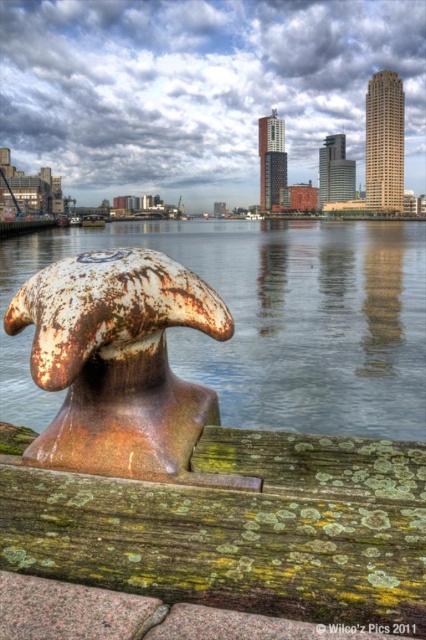
Question: Does rusty metal bollard at lower left appear on the left side of rusty metal bollard at left?

Choices:
 (A) yes
 (B) no

Answer: (B)

Question: Which object is farther from the camera taking this photo?

Choices:
 (A) rusty metal bollard at left
 (B) rusty metal bollard at lower left

Answer: (B)

Question: Does green mossy wood at lower center have a lesser width compared to rusty metal bollard at lower left?

Choices:
 (A) yes
 (B) no

Answer: (A)

Question: Which of these objects is positioned farthest from the rusty metal bollard at lower left?

Choices:
 (A) green mossy wood at lower center
 (B) rusty metal bollard at left

Answer: (A)

Question: Among these objects, which one is farthest from the camera?

Choices:
 (A) green mossy wood at lower center
 (B) rusty metal bollard at lower left
 (C) rusty metal bollard at left

Answer: (B)

Question: Can you confirm if green mossy wood at lower center is positioned above rusty metal bollard at lower left?

Choices:
 (A) yes
 (B) no

Answer: (B)